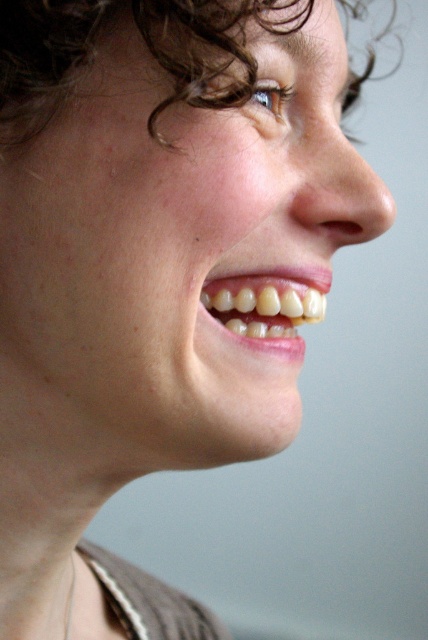
In the scene shown: Between smooth skin face at center and natural white teeth at center, which one appears on the right side from the viewer's perspective?

natural white teeth at center is more to the right.

Is smooth skin face at center wider than natural white teeth at center?

Yes.

Locate an element on the screen. smooth skin face at center is located at coordinates (171, 252).

Is point (335, 84) positioned behind point (65, 636)?

No.

Is smooth skin face at center further to the viewer compared to silver metallic necklace at lower left?

No, it is not.

Image resolution: width=428 pixels, height=640 pixels. What do you see at coordinates (171, 252) in the screenshot?
I see `smooth skin face at center` at bounding box center [171, 252].

You are a GUI agent. You are given a task and a screenshot of the screen. Output one action in this format:
    pyautogui.click(x=<x>, y=<y>)
    Task: Click on the smooth skin face at center
    This screenshot has height=640, width=428.
    Given the screenshot: What is the action you would take?
    pyautogui.click(x=171, y=252)

Does curly brown hair at upper center appear on the left side of natural white teeth at center?

In fact, curly brown hair at upper center is to the right of natural white teeth at center.

Where is `curly brown hair at upper center`? This screenshot has width=428, height=640. curly brown hair at upper center is located at coordinates (145, 44).